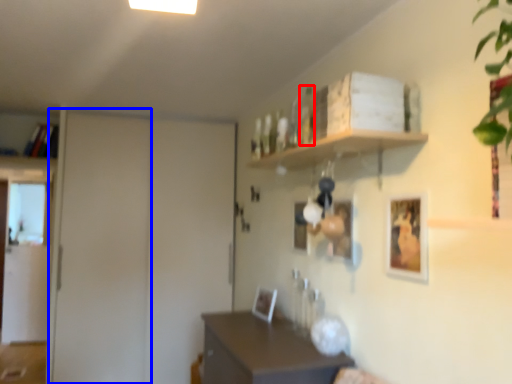
Question: Which point is further to the camera, bottle (highlighted by a red box) or door (highlighted by a blue box)?

Choices:
 (A) bottle
 (B) door

Answer: (B)